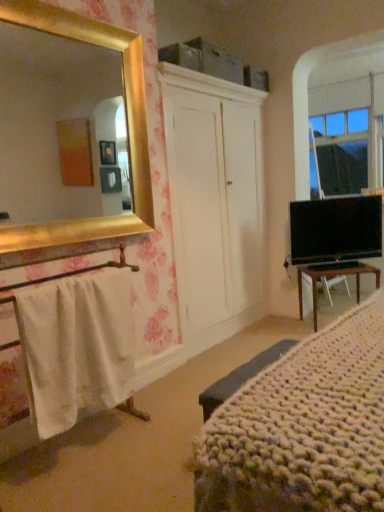
Where is `free region on the left part of brown wooden desk at lower right`? Image resolution: width=384 pixels, height=512 pixels. free region on the left part of brown wooden desk at lower right is located at coordinates (284, 330).